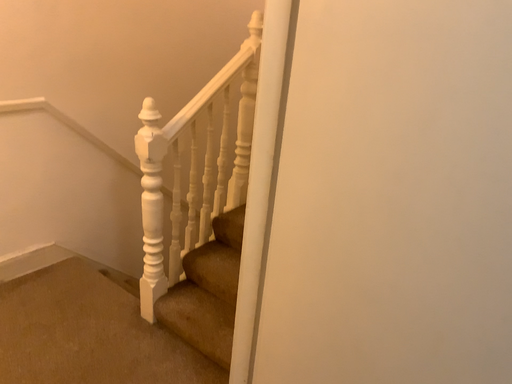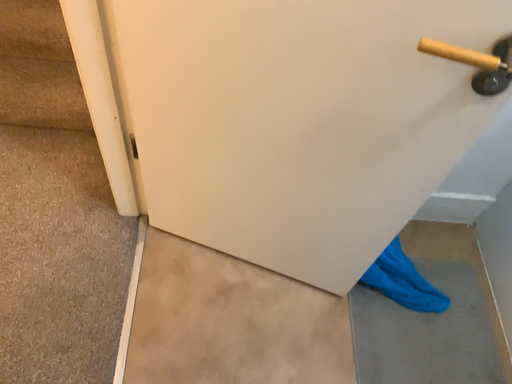
Question: Which way did the camera rotate in the video?

Choices:
 (A) rotated downward
 (B) rotated upward

Answer: (A)